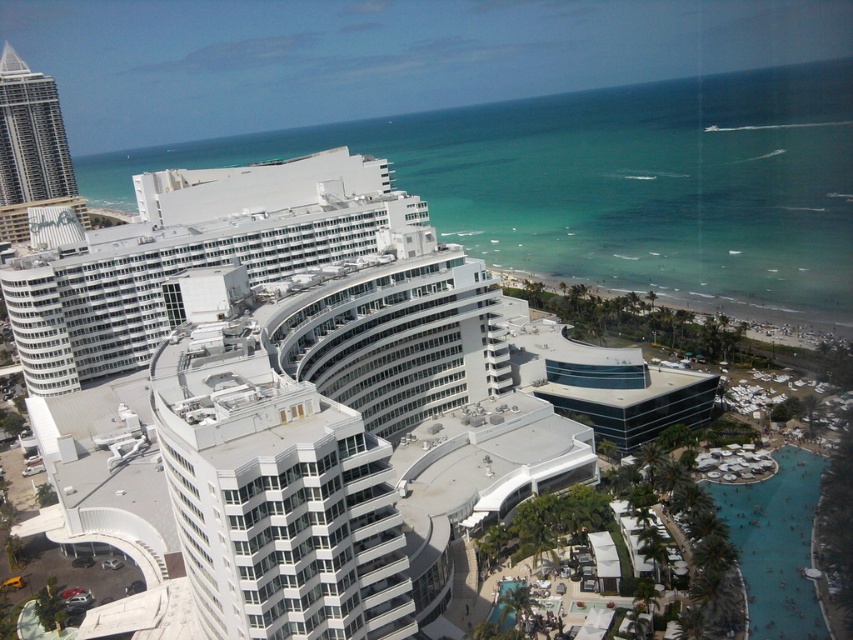
Question: From the image, what is the correct spatial relationship of white glass building at center in relation to matte white skyscraper at left?

Choices:
 (A) right
 (B) left

Answer: (A)

Question: Is white glass building at center wider than matte white skyscraper at left?

Choices:
 (A) yes
 (B) no

Answer: (A)

Question: Is white glass building at center smaller than matte white skyscraper at left?

Choices:
 (A) yes
 (B) no

Answer: (B)